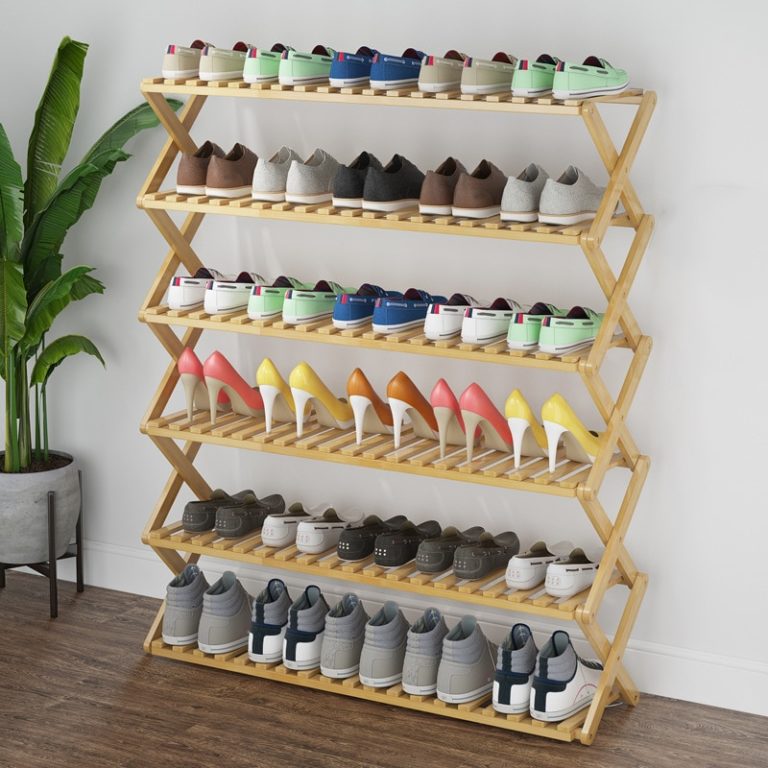
The height and width of the screenshot is (768, 768). Find the location of `wooden shelves`. wooden shelves is located at coordinates (426, 101), (429, 224), (429, 349), (462, 472), (464, 593), (485, 717).